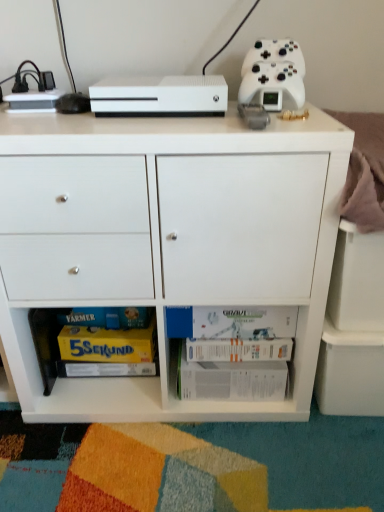
The width and height of the screenshot is (384, 512). In order to click on vacant area that is in front of white paper book at lower center, which appears as the first book when ordered from the bottom in this screenshot , I will do `click(236, 454)`.